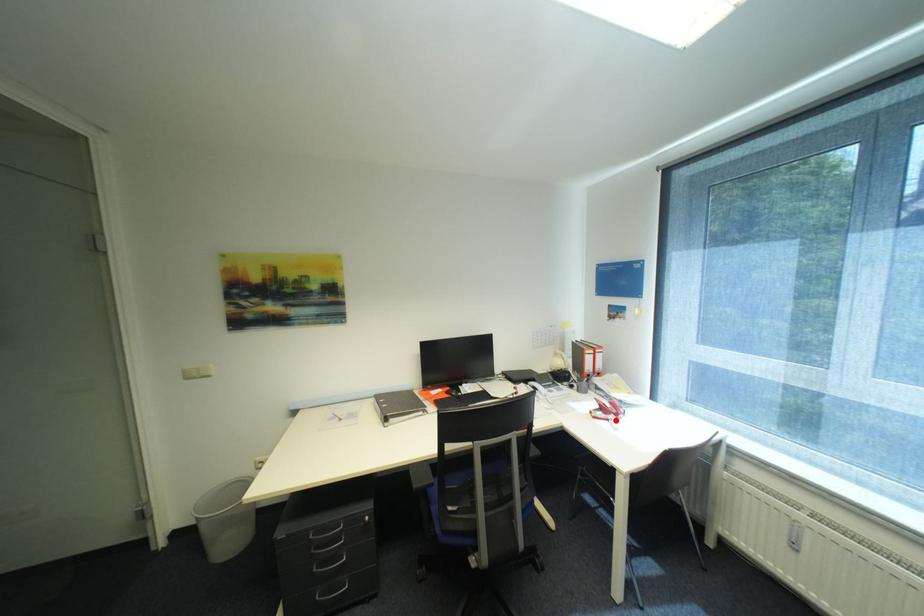
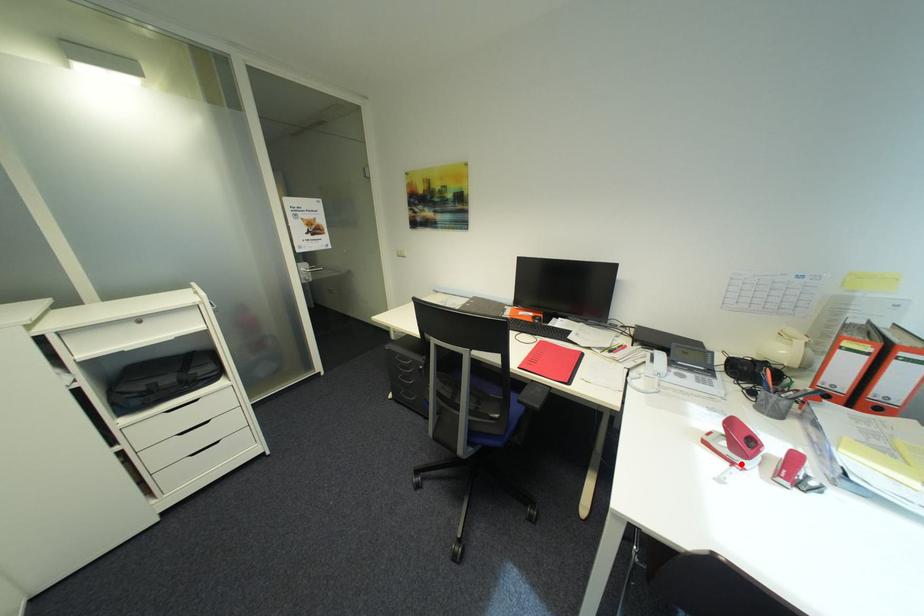
I am providing you with two images of the same scene from different viewpoints. A red point is marked on the first image and another point is marked on the second image. Does the point marked in image1 correspond to the same location as the one in image2?

Yes